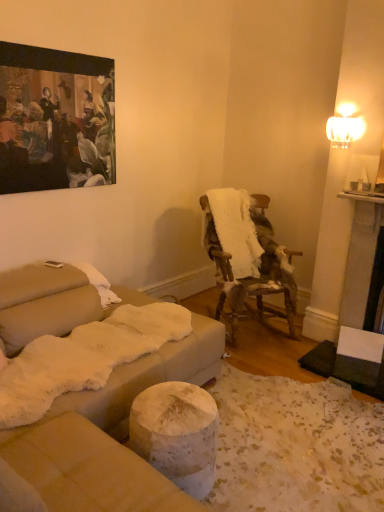
Question: Relative to fur-covered wooden chair at center-right, is oil painting at upper left in front or behind?

Choices:
 (A) behind
 (B) front

Answer: (B)

Question: Based on their sizes in the image, would you say oil painting at upper left is bigger or smaller than fur-covered wooden chair at center-right?

Choices:
 (A) big
 (B) small

Answer: (B)

Question: Which of these objects is positioned closest to the white fluffy blanket at center-right?

Choices:
 (A) fur-covered wooden chair at center-right
 (B) oil painting at upper left

Answer: (A)

Question: Based on their relative distances, which object is nearer to the fur-covered wooden chair at center-right?

Choices:
 (A) oil painting at upper left
 (B) white fluffy blanket at center-right

Answer: (B)